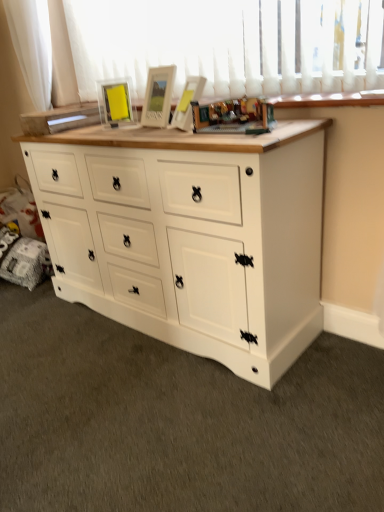
Question: Does white fabric curtain at upper left turn towards white painted wood chest of drawers at center?

Choices:
 (A) no
 (B) yes

Answer: (A)

Question: Does white fabric curtain at upper left appear on the right side of white painted wood chest of drawers at center?

Choices:
 (A) yes
 (B) no

Answer: (B)

Question: Is the position of white fabric curtain at upper left more distant than that of white painted wood chest of drawers at center?

Choices:
 (A) no
 (B) yes

Answer: (B)

Question: Can you confirm if white fabric curtain at upper left is taller than white painted wood chest of drawers at center?

Choices:
 (A) yes
 (B) no

Answer: (B)

Question: From the image's perspective, is white fabric curtain at upper left below white painted wood chest of drawers at center?

Choices:
 (A) yes
 (B) no

Answer: (B)

Question: Is white fabric curtain at upper left spatially inside wooden toy at center, or outside of it?

Choices:
 (A) inside
 (B) outside

Answer: (B)

Question: Is white fabric curtain at upper left wider or thinner than wooden toy at center?

Choices:
 (A) wide
 (B) thin

Answer: (B)

Question: Is point (31, 89) closer or farther from the camera than point (236, 112)?

Choices:
 (A) closer
 (B) farther

Answer: (B)

Question: From a real-world perspective, is white fabric curtain at upper left physically located above or below wooden toy at center?

Choices:
 (A) above
 (B) below

Answer: (A)

Question: From a real-world perspective, is white fabric curtain at upper left physically located above or below matte glass picture frame at upper center?

Choices:
 (A) above
 (B) below

Answer: (A)

Question: Is white fabric curtain at upper left inside or outside of matte glass picture frame at upper center?

Choices:
 (A) inside
 (B) outside

Answer: (B)

Question: From their relative heights in the image, would you say white fabric curtain at upper left is taller or shorter than matte glass picture frame at upper center?

Choices:
 (A) short
 (B) tall

Answer: (B)

Question: In terms of size, does white fabric curtain at upper left appear bigger or smaller than matte glass picture frame at upper center?

Choices:
 (A) small
 (B) big

Answer: (B)

Question: Is matte glass picture frame at upper center taller or shorter than wooden toy at center?

Choices:
 (A) short
 (B) tall

Answer: (B)

Question: Based on their positions, is matte glass picture frame at upper center located to the left or right of wooden toy at center?

Choices:
 (A) right
 (B) left

Answer: (B)